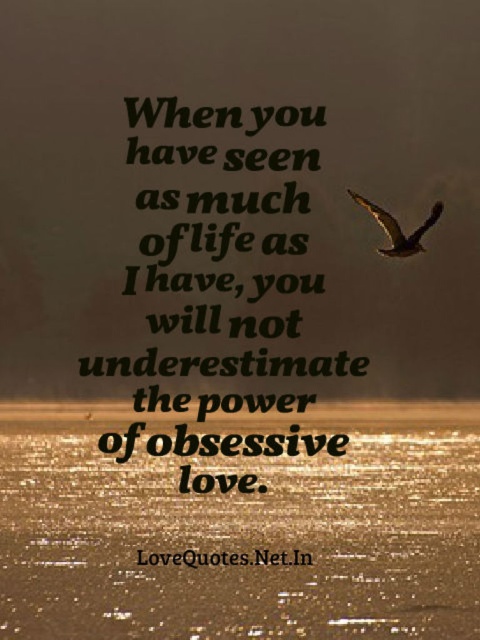
Is black paper quote at center positioned in front of brown feathered bird at upper right?

Yes, it is.

Between black paper quote at center and brown feathered bird at upper right, which one is positioned lower?

Positioned lower is black paper quote at center.

Find the location of a particular element. This screenshot has width=480, height=640. black paper quote at center is located at coordinates (225, 305).

What do you see at coordinates (241, 540) in the screenshot? I see `shiny metallic water at bottom` at bounding box center [241, 540].

Is point (164, 528) positioned before point (219, 560)?

That is False.

The image size is (480, 640). What do you see at coordinates (241, 540) in the screenshot?
I see `shiny metallic water at bottom` at bounding box center [241, 540].

This screenshot has height=640, width=480. In order to click on shiny metallic water at bottom in this screenshot , I will do `click(241, 540)`.

Can you confirm if black text at center is thinner than brown feathered bird at upper right?

No, black text at center is not thinner than brown feathered bird at upper right.

Is black text at center smaller than brown feathered bird at upper right?

Incorrect, black text at center is not smaller in size than brown feathered bird at upper right.

The width and height of the screenshot is (480, 640). I want to click on black text at center, so 224,557.

Locate an element on the screen. This screenshot has width=480, height=640. black text at center is located at coordinates (224, 557).